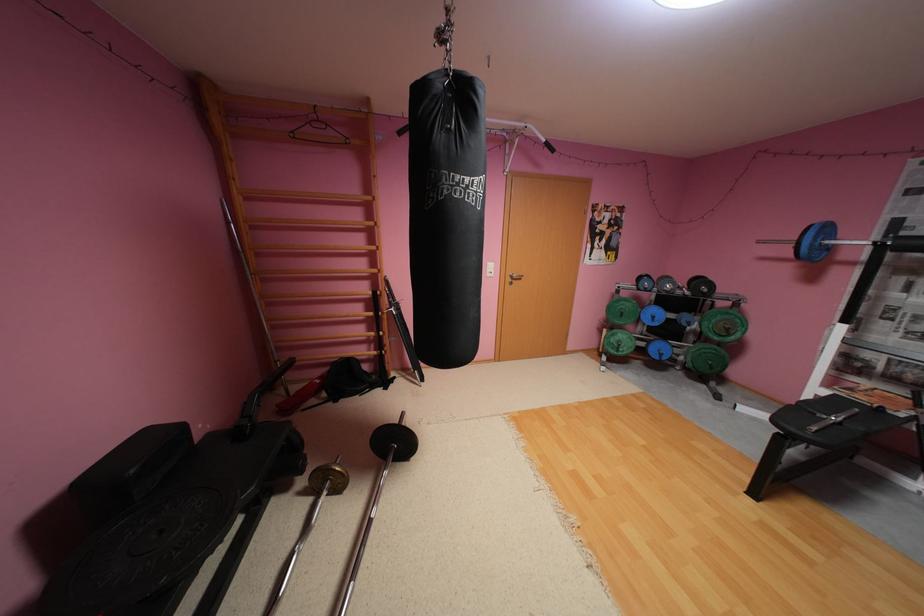
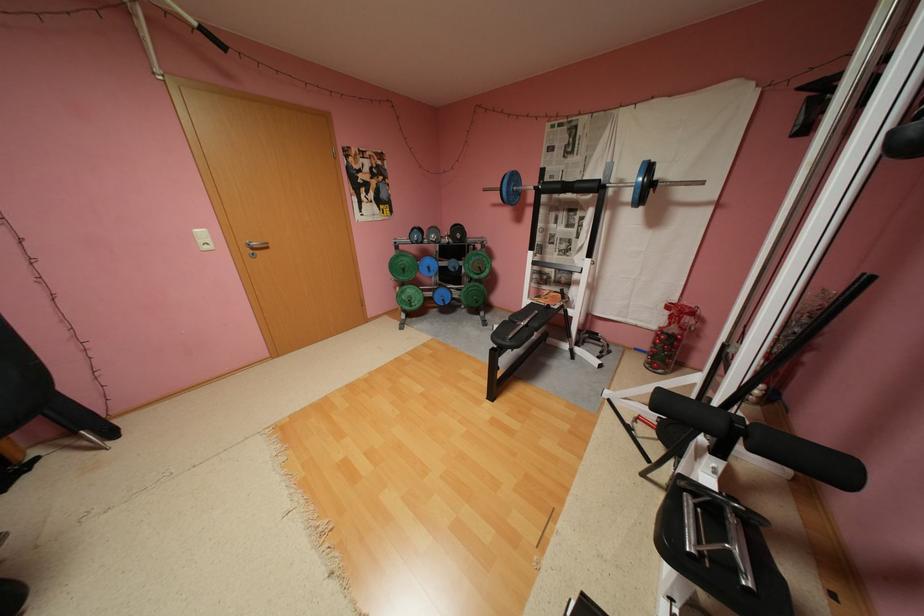
Where in the second image is the point corresponding to point 626,351 from the first image?

(419, 306)